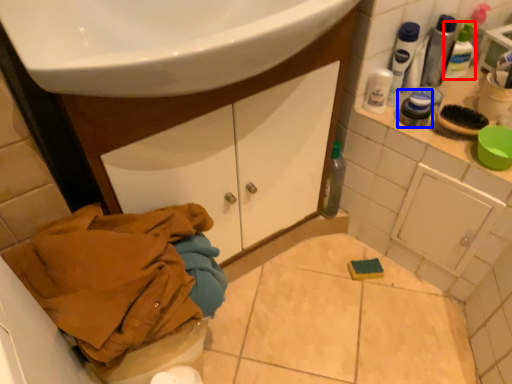
Question: Which point is further to the camera, mouthwash (highlighted by a red box) or toiletry (highlighted by a blue box)?

Choices:
 (A) mouthwash
 (B) toiletry

Answer: (A)